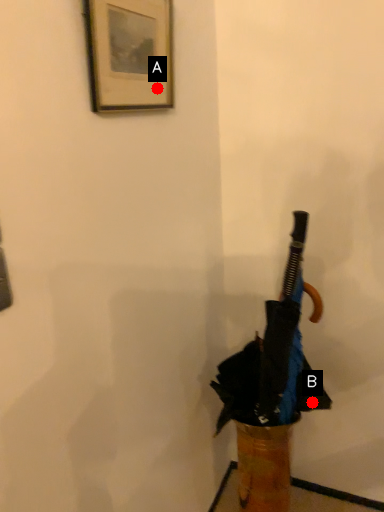
Question: Two points are circled on the image, labeled by A and B beside each circle. Which point is farther from the camera taking this photo?

Choices:
 (A) A is further
 (B) B is further

Answer: (B)